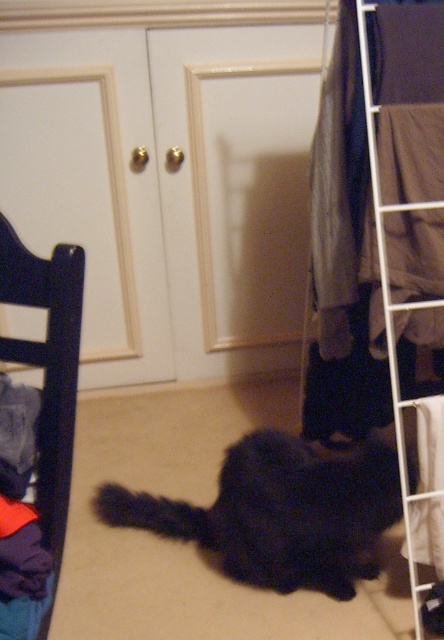
Question: Which object appears closest to the camera in this image?

Choices:
 (A) dark wood chair at left
 (B) black fluffy cat at center
 (C) white wire rack at right

Answer: (A)

Question: Is black fluffy cat at center bigger than dark wood chair at left?

Choices:
 (A) no
 (B) yes

Answer: (B)

Question: Observing the image, what is the correct spatial positioning of dark wood chair at left in reference to white wire rack at right?

Choices:
 (A) above
 (B) below

Answer: (B)

Question: Which of the following is the closest to the observer?

Choices:
 (A) (147, 493)
 (B) (58, 456)
 (C) (381, 276)

Answer: (B)

Question: Among these objects, which one is farthest from the camera?

Choices:
 (A) black fluffy cat at center
 (B) white wire rack at right
 (C) dark wood chair at left

Answer: (A)

Question: Does black fluffy cat at center appear on the left side of dark wood chair at left?

Choices:
 (A) yes
 (B) no

Answer: (B)